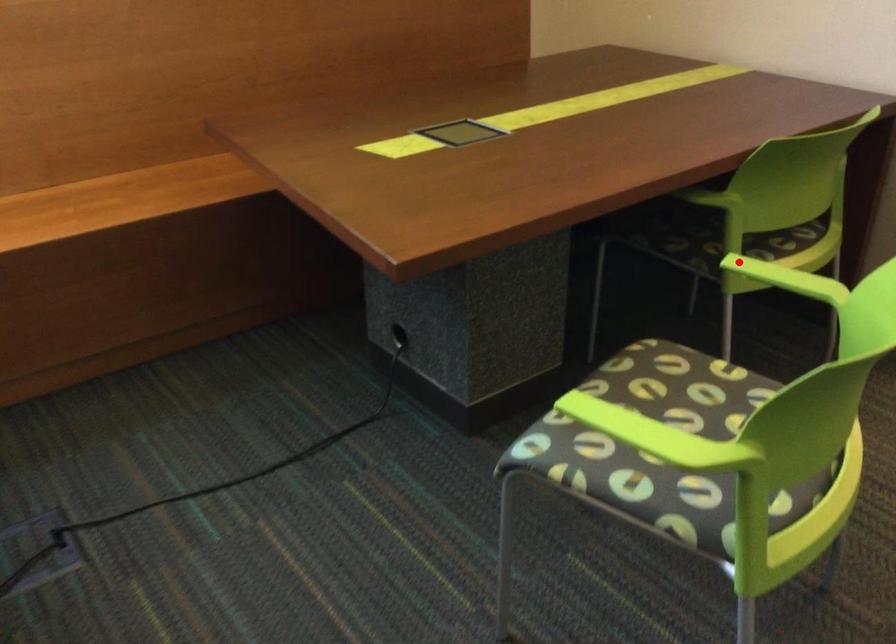
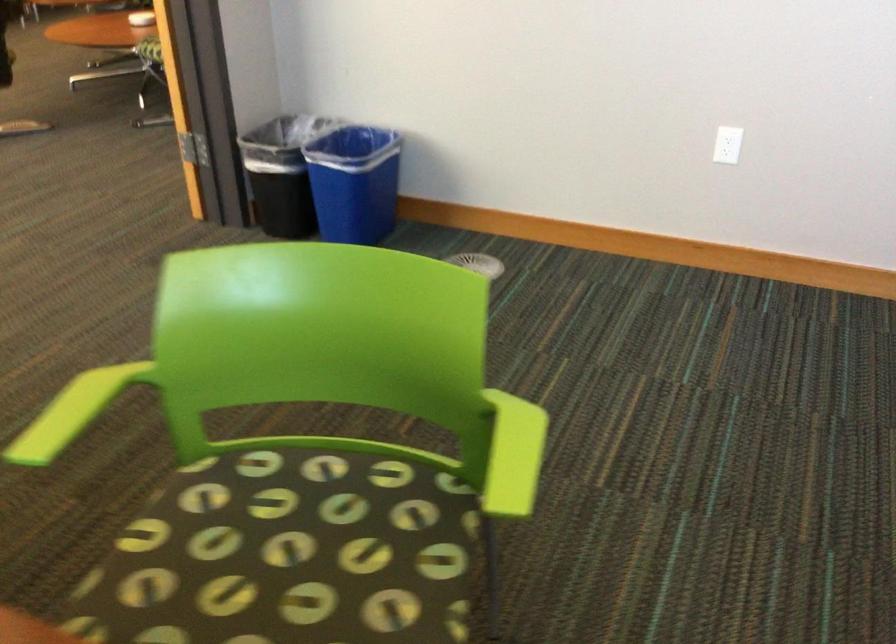
Find the pixel in the second image that matches the highlighted location in the first image.

(55, 429)